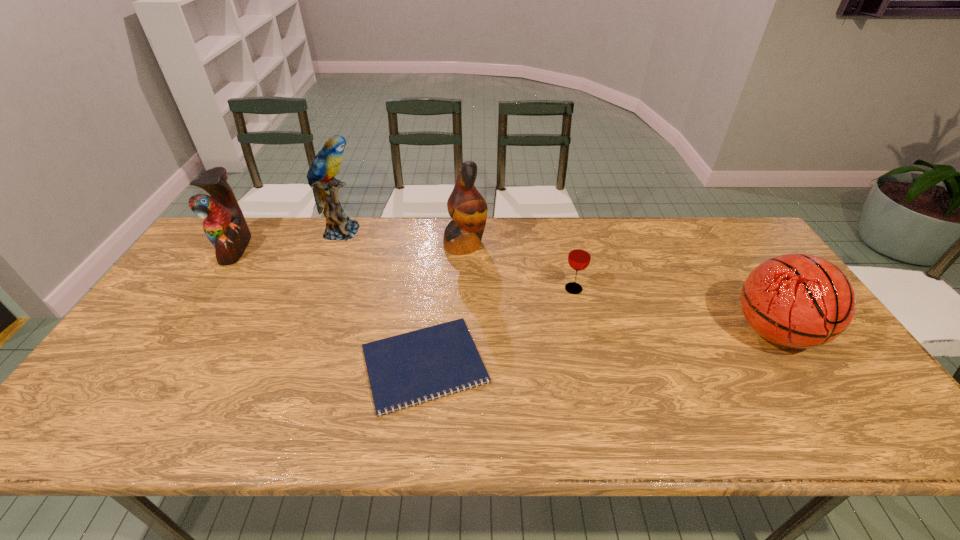
The width and height of the screenshot is (960, 540). In order to click on blank space that satisfies the following two spatial constraints: 1. on the back side of the notepad; 2. on the face of the fifth object from right to left in this screenshot , I will do `click(440, 231)`.

You are a GUI agent. You are given a task and a screenshot of the screen. Output one action in this format:
    pyautogui.click(x=<x>, y=<y>)
    Task: Click on the free spot that satisfies the following two spatial constraints: 1. on the back side of the shortest object; 2. on the face of the fifth object from right to left
    Image resolution: width=960 pixels, height=540 pixels.
    Given the screenshot: What is the action you would take?
    pyautogui.click(x=440, y=231)

What are the coordinates of `vacant space that satisfies the following two spatial constraints: 1. at the face of the third nearest object; 2. on the left side of the leftmost object` in the screenshot? It's located at (208, 289).

Find the location of `vacant space that satisfies the following two spatial constraints: 1. on the back side of the second object from right to left; 2. at the face of the leftmost parrot`. vacant space that satisfies the following two spatial constraints: 1. on the back side of the second object from right to left; 2. at the face of the leftmost parrot is located at coordinates (564, 248).